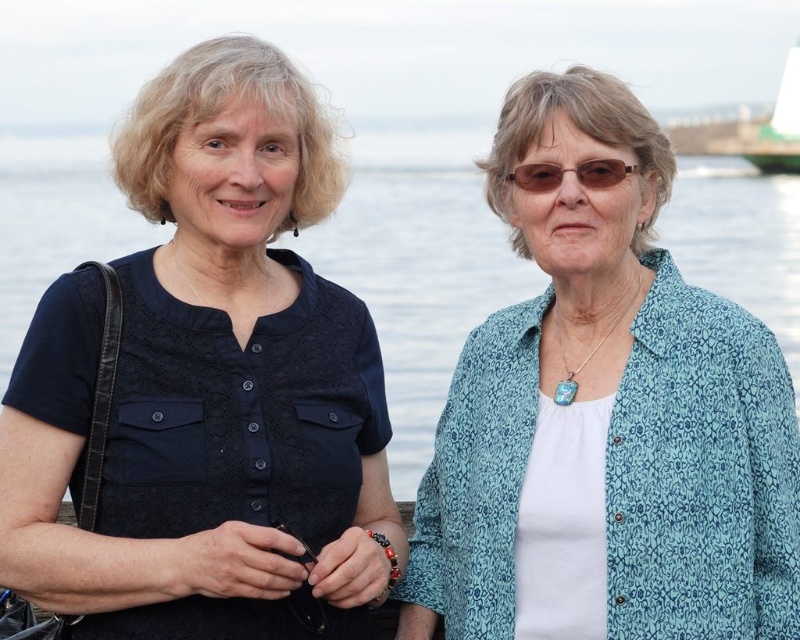
Is blue patterned shirt at right bigger than transparent water at center?

No, blue patterned shirt at right is not bigger than transparent water at center.

Between point (562, 316) and point (470, 179), which one is positioned behind?

Point (470, 179)

Between point (524, 468) and point (441, 266), which one is positioned in front?

Point (524, 468)

Where is `blue patterned shirt at right`? The image size is (800, 640). blue patterned shirt at right is located at coordinates (608, 412).

Is the position of transparent water at center less distant than that of green matte boat at upper right?

Yes, it is in front of green matte boat at upper right.

Is transparent water at center positioned behind green matte boat at upper right?

No, transparent water at center is in front of green matte boat at upper right.

Which is behind, point (472, 212) or point (748, 156)?

Positioned behind is point (748, 156).

At what (x,y) coordinates should I click in order to perform the action: click on transparent water at center. Please return your answer as a coordinate pair (x, y). The width and height of the screenshot is (800, 640). Looking at the image, I should click on (418, 284).

Who is taller, matte black blouse at left or blue patterned shirt at right?

With more height is matte black blouse at left.

Which is below, matte black blouse at left or blue patterned shirt at right?

blue patterned shirt at right is lower down.

In order to click on matte black blouse at left in this screenshot , I will do `click(206, 388)`.